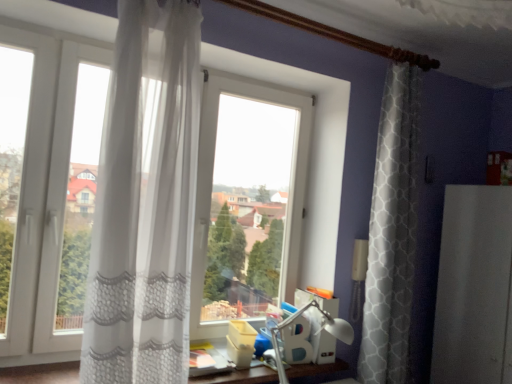
Question: Can you confirm if white sheer curtain at left is positioned to the right of white plastic table lamp at center?

Choices:
 (A) yes
 (B) no

Answer: (B)

Question: Is white sheer curtain at left in contact with white plastic table lamp at center?

Choices:
 (A) yes
 (B) no

Answer: (B)

Question: Is white sheer curtain at left not inside white plastic table lamp at center?

Choices:
 (A) yes
 (B) no

Answer: (A)

Question: Does white sheer curtain at left come behind white plastic table lamp at center?

Choices:
 (A) yes
 (B) no

Answer: (B)

Question: From a real-world perspective, is white sheer curtain at left located higher than white plastic table lamp at center?

Choices:
 (A) yes
 (B) no

Answer: (A)

Question: In the image, is white plastic table lamp at center positioned in front of or behind white sheer curtain at left?

Choices:
 (A) front
 (B) behind

Answer: (B)

Question: From a real-world perspective, is white plastic table lamp at center physically located above or below white sheer curtain at left?

Choices:
 (A) above
 (B) below

Answer: (B)

Question: Would you say white plastic table lamp at center is inside or outside white sheer curtain at left?

Choices:
 (A) outside
 (B) inside

Answer: (A)

Question: Based on their positions, is white plastic table lamp at center located to the left or right of white sheer curtain at left?

Choices:
 (A) left
 (B) right

Answer: (B)

Question: From a real-world perspective, is white matte screen door at right physically located above or below white sheer curtain at left?

Choices:
 (A) above
 (B) below

Answer: (B)

Question: In the image, is white matte screen door at right positioned in front of or behind white sheer curtain at left?

Choices:
 (A) front
 (B) behind

Answer: (B)

Question: Does point (470, 336) appear closer or farther from the camera than point (188, 183)?

Choices:
 (A) closer
 (B) farther

Answer: (B)

Question: In terms of height, does white matte screen door at right look taller or shorter compared to white sheer curtain at left?

Choices:
 (A) short
 (B) tall

Answer: (A)

Question: From a real-world perspective, is white sheer curtain at left positioned above or below white plastic table lamp at center?

Choices:
 (A) below
 (B) above

Answer: (B)

Question: Based on their sizes in the image, would you say white sheer curtain at left is bigger or smaller than white plastic table lamp at center?

Choices:
 (A) small
 (B) big

Answer: (B)